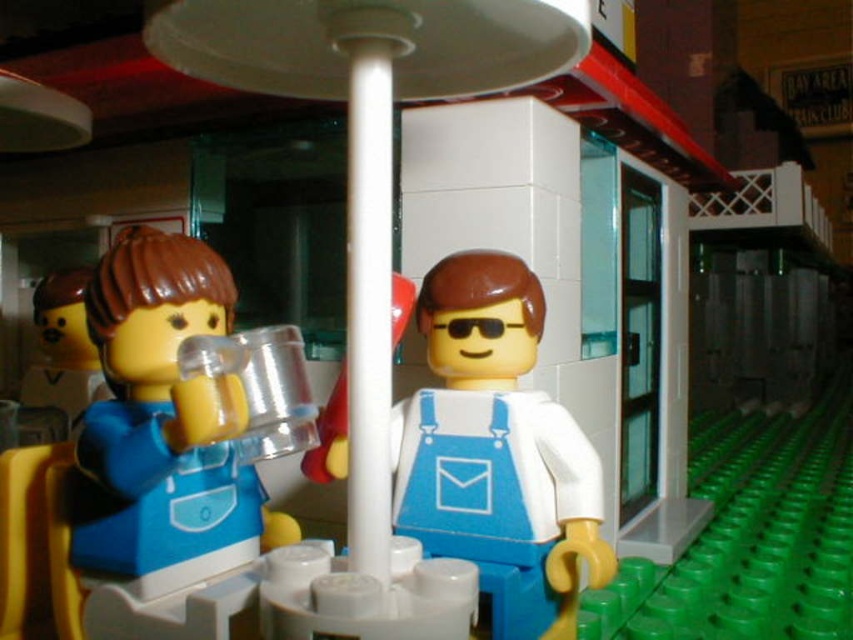
Does white matte overalls at center appear over matte plastic cup at left?

Actually, white matte overalls at center is below matte plastic cup at left.

Who is more forward, (521,566) or (82,372)?

Positioned in front is point (521,566).

Where is `white matte overalls at center`? white matte overalls at center is located at coordinates (497, 452).

Does white matte overalls at center have a lesser width compared to translucent plastic cup at left?

No.

What do you see at coordinates (497, 452) in the screenshot? The image size is (853, 640). I see `white matte overalls at center` at bounding box center [497, 452].

Identify the location of white matte overalls at center. This screenshot has width=853, height=640. pos(497,452).

Between translucent plastic cup at left and matte plastic cup at left, which one appears on the left side from the viewer's perspective?

From the viewer's perspective, matte plastic cup at left appears more on the left side.

Who is higher up, translucent plastic cup at left or matte plastic cup at left?

matte plastic cup at left

Identify the location of translucent plastic cup at left. Image resolution: width=853 pixels, height=640 pixels. (163, 428).

At what (x,y) coordinates should I click in order to perform the action: click on translucent plastic cup at left. Please return your answer as a coordinate pair (x, y). Looking at the image, I should click on (163, 428).